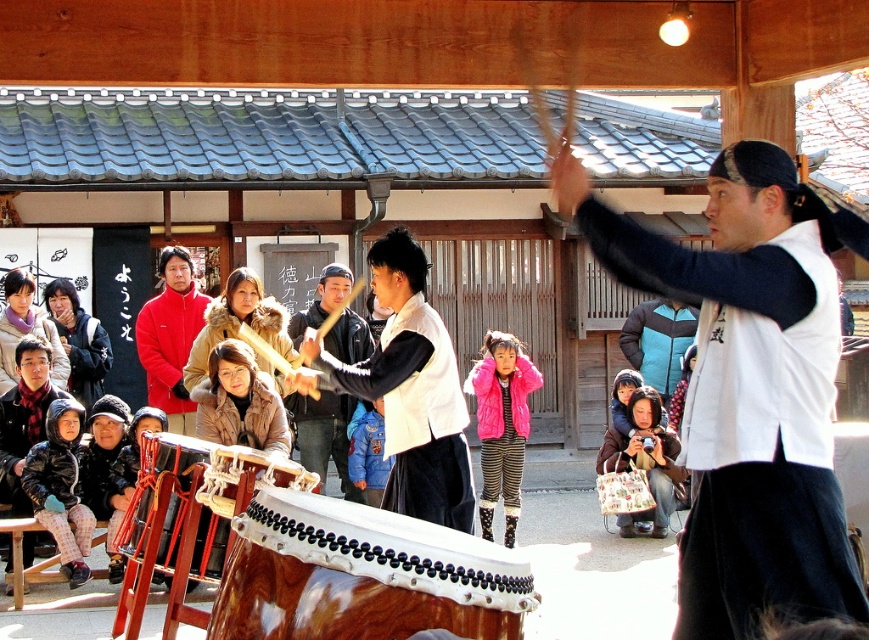
Is matte black vest at center taller than pink puffy coat at center?

In fact, matte black vest at center may be shorter than pink puffy coat at center.

Is matte black vest at center above pink puffy coat at center?

Yes.

Does point (392, 481) lie in front of point (514, 360)?

Yes, point (392, 481) is in front of point (514, 360).

Image resolution: width=869 pixels, height=640 pixels. I want to click on matte black vest at center, so click(408, 390).

Is fluffy pink coat at lower center taller than blue denim jacket at center?

Yes.

Is fluffy pink coat at lower center above blue denim jacket at center?

Incorrect, fluffy pink coat at lower center is not positioned above blue denim jacket at center.

At what (x,y) coordinates should I click in order to perform the action: click on fluffy pink coat at lower center. Please return your answer as a coordinate pair (x, y). Looking at the image, I should click on (645, 460).

This screenshot has width=869, height=640. I want to click on fluffy pink coat at lower center, so click(x=645, y=460).

Between shiny brown drum at center and red fleece jacket at upper left, which one is positioned lower?

shiny brown drum at center is below.

Does shiny brown drum at center have a lesser height compared to red fleece jacket at upper left?

Yes, shiny brown drum at center is shorter than red fleece jacket at upper left.

Consider the image. Who is more forward, (314, 538) or (157, 348)?

Positioned in front is point (314, 538).

This screenshot has height=640, width=869. Identify the location of shiny brown drum at center. (362, 576).